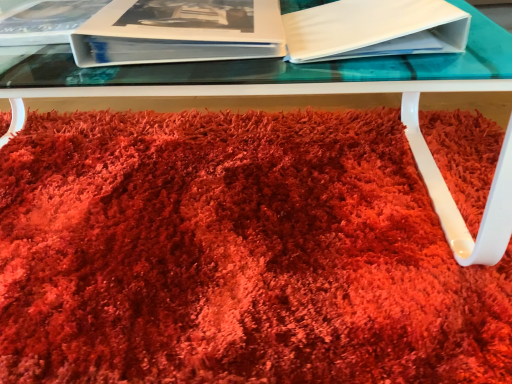
Question: From the image's perspective, relative to white glossy book at upper left, the second paperback book viewed from the right, is shaggy red carpet at center above or below?

Choices:
 (A) above
 (B) below

Answer: (B)

Question: Is point (508, 306) closer or farther from the camera than point (245, 3)?

Choices:
 (A) farther
 (B) closer

Answer: (B)

Question: Considering the real-world distances, which object is farthest from the white glossy album at upper left?

Choices:
 (A) white matte book at upper right, which is the second paperback book in left-to-right order
 (B) shaggy red carpet at center
 (C) white glossy book at upper left, the second paperback book viewed from the right

Answer: (B)

Question: Based on their relative distances, which object is nearer to the white glossy album at upper left?

Choices:
 (A) white matte book at upper right, which is the second paperback book in left-to-right order
 (B) white glossy book at upper left, acting as the first paperback book starting from the left
 (C) shaggy red carpet at center

Answer: (B)